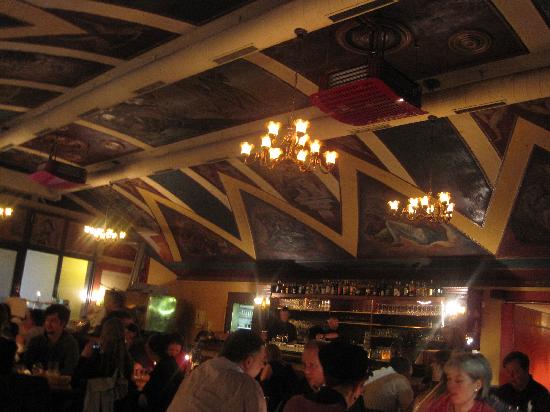
Locate an element on the screen. The image size is (550, 412). chandeliers is located at coordinates (429, 198), (297, 142), (113, 229), (5, 209).